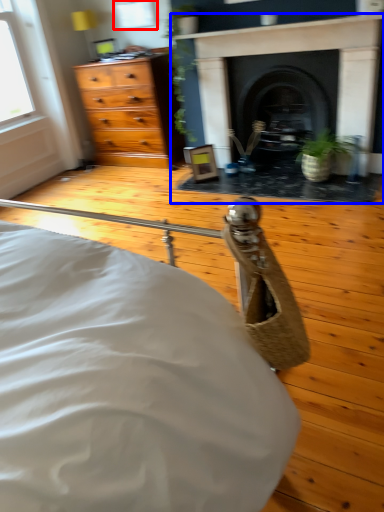
Question: Among these objects, which one is nearest to the camera, window (highlighted by a red box) or fireplace (highlighted by a blue box)?

Choices:
 (A) window
 (B) fireplace

Answer: (B)